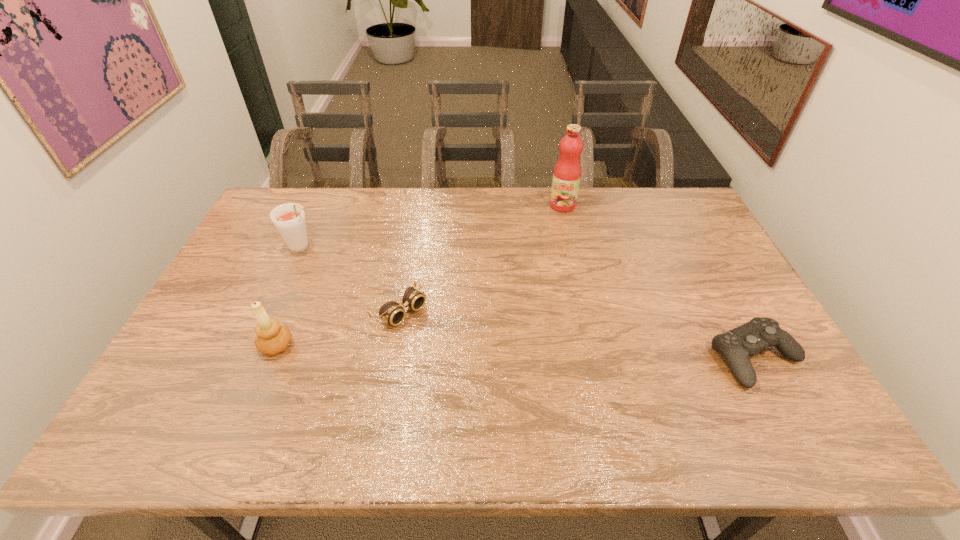
At what (x,y) coordinates should I click in order to perform the action: click on empty space that is in between the candle_holder and the fourth tallest object. Please return your answer as a coordinate pair (x, y). Looking at the image, I should click on (516, 352).

Locate an element on the screen. empty space between the control and the third object from left to right is located at coordinates (578, 334).

At what (x,y) coordinates should I click in order to perform the action: click on free space between the candle_holder and the goggles. Please return your answer as a coordinate pair (x, y). Looking at the image, I should click on (338, 328).

Find the location of a particular element. The width and height of the screenshot is (960, 540). free area in between the control and the root beer is located at coordinates (529, 302).

Identify the location of empty space that is in between the farthest object and the rightmost object. The width and height of the screenshot is (960, 540). (659, 281).

Image resolution: width=960 pixels, height=540 pixels. What are the coordinates of `vacant region between the candle_holder and the fruit juice` in the screenshot? It's located at (420, 275).

The image size is (960, 540). Find the location of `free area in between the third object from right to left and the root beer`. free area in between the third object from right to left and the root beer is located at coordinates (351, 279).

Image resolution: width=960 pixels, height=540 pixels. Identify the location of vacant region between the goggles and the candle_holder. (338, 328).

Find the location of a particular element. This screenshot has width=960, height=540. unoccupied area between the fourth tallest object and the candle_holder is located at coordinates (516, 352).

You are a GUI agent. You are given a task and a screenshot of the screen. Output one action in this format:
    pyautogui.click(x=<x>, y=<y>)
    Task: Click on the third closest object relative to the root beer
    The height and width of the screenshot is (540, 960).
    Given the screenshot: What is the action you would take?
    pyautogui.click(x=567, y=172)